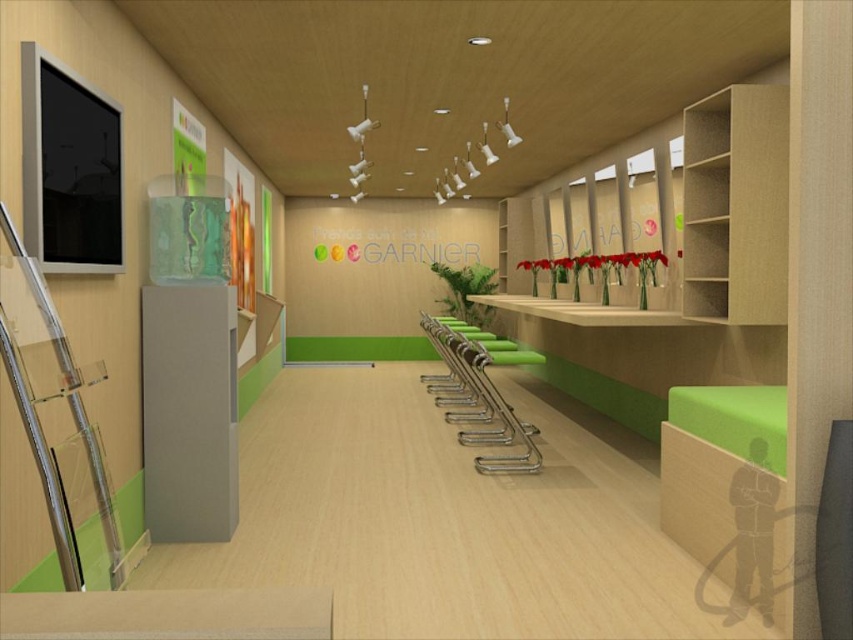
Question: Which object appears closest to the camera in this image?

Choices:
 (A) clear acrylic ladder at left
 (B) green plastic chair at center

Answer: (A)

Question: Does clear acrylic ladder at left have a smaller size compared to green plastic chair at center?

Choices:
 (A) no
 (B) yes

Answer: (B)

Question: Can you confirm if clear acrylic ladder at left is bigger than green plastic chair at center?

Choices:
 (A) no
 (B) yes

Answer: (A)

Question: Where is clear acrylic ladder at left located in relation to green plastic chair at center in the image?

Choices:
 (A) above
 (B) below

Answer: (A)